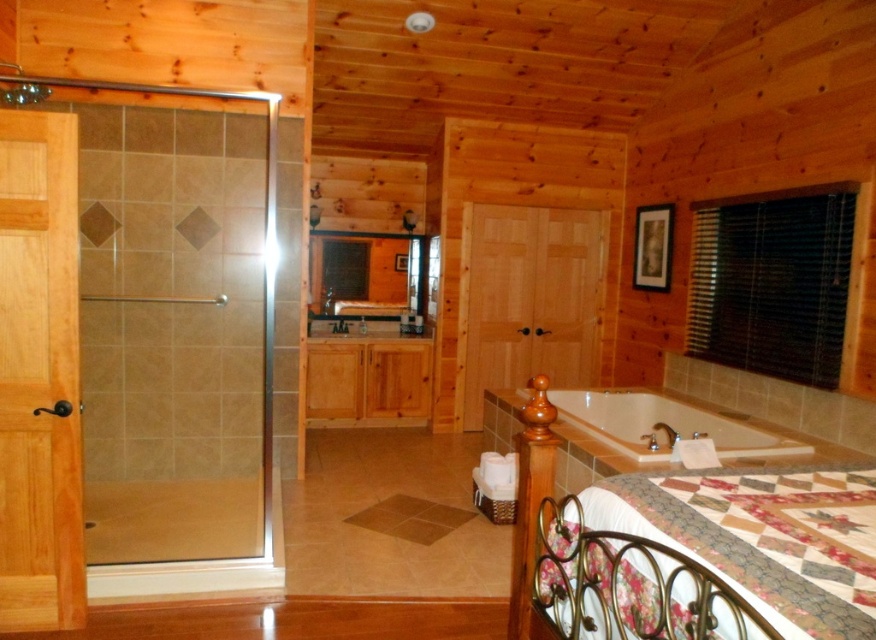
You are a delivery person who needs to place a large package that is 10 feet long in the bathroom. The package must be placed horizontally. Given the space between the clear glass door at left and the white glossy bathtub at lower right, can the package fit horizontally in this bathroom?

The distance between the clear glass door at left and the white glossy bathtub at lower right is 9.31 feet. Since the package is 10 feet long, it cannot fit horizontally in this space as the available length is shorter than the package.

You are designing a layout for a bathroom and need to place a narrow shelf between the wooden cabinet at center and the white glossy bathtub at lower right. Which object should the shelf be placed closer to if it must align with the narrower side?

The wooden cabinet at center is thinner than the white glossy bathtub at lower right, so the shelf should be placed closer to the wooden cabinet at center to align with its narrower side.